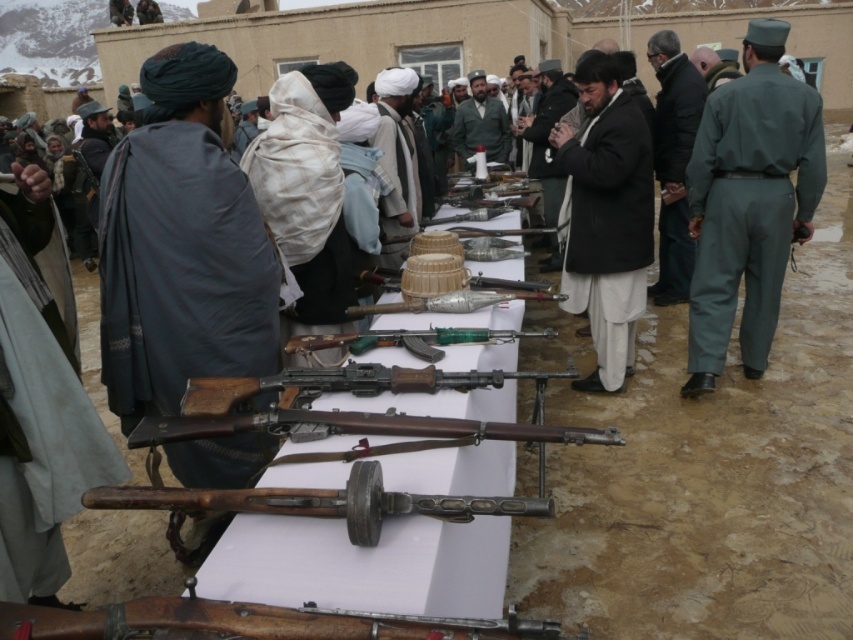
Question: From the image, what is the correct spatial relationship of rusty wood rifle at center in relation to black matte jacket at center?

Choices:
 (A) right
 (B) left

Answer: (B)

Question: Which point is closer to the camera taking this photo?

Choices:
 (A) (386, 154)
 (B) (607, 275)
 (C) (474, 100)

Answer: (B)

Question: Which is farther from the dark gray woolen robe at left?

Choices:
 (A) black matte jacket at center
 (B) black woolen robe at center

Answer: (A)

Question: Can you confirm if rusty wood rifle at center is positioned to the right of black matte jacket at center?

Choices:
 (A) no
 (B) yes

Answer: (A)

Question: Which of the following is the farthest from the observer?

Choices:
 (A) white woolen turban at center
 (B) rusty wood rifle at center

Answer: (A)

Question: Is black woolen robe at center to the right of black matte jacket at center from the viewer's perspective?

Choices:
 (A) no
 (B) yes

Answer: (A)